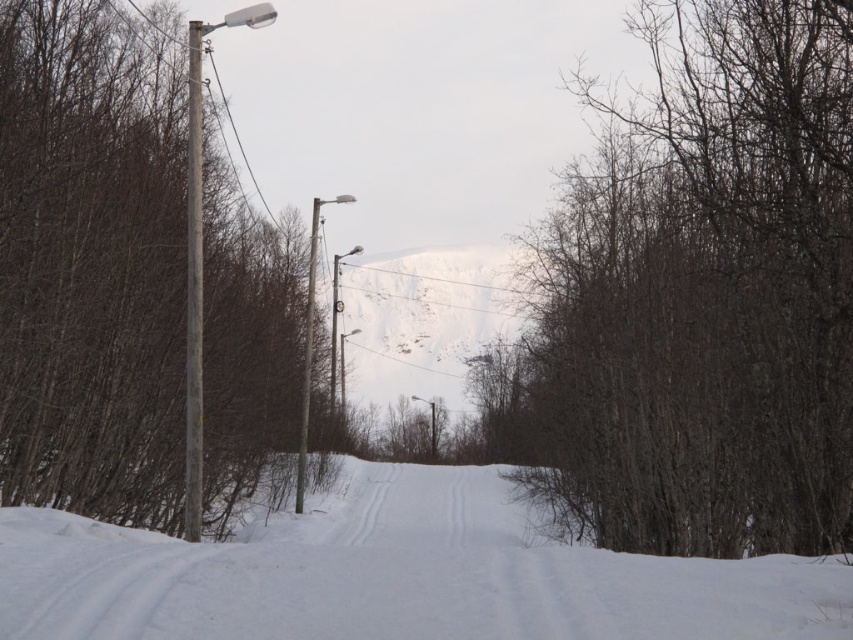
Is smooth brown pole at left to the right of white powdery snow at center from the viewer's perspective?

In fact, smooth brown pole at left is to the left of white powdery snow at center.

Find the location of a particular element. smooth brown pole at left is located at coordinates [x=134, y=275].

Is point (125, 467) more distant than point (793, 605)?

Yes, it is behind point (793, 605).

Identify the location of smooth brown pole at left. The width and height of the screenshot is (853, 640). (134, 275).

Between smooth brown pole at left and smooth gray pole at left, which one appears on the right side from the viewer's perspective?

Positioned to the right is smooth gray pole at left.

Which is more to the left, smooth brown pole at left or smooth gray pole at left?

A: smooth brown pole at left is more to the left.

Locate an element on the screen. This screenshot has height=640, width=853. smooth brown pole at left is located at coordinates (134, 275).

Locate an element on the screen. The height and width of the screenshot is (640, 853). smooth brown pole at left is located at coordinates (134, 275).

Between brown/dry wood at center and white powdery snow at center, which one is positioned higher?

Positioned higher is brown/dry wood at center.

Can you confirm if brown/dry wood at center is shorter than white powdery snow at center?

No.

Is point (843, 531) positioned behind point (126, 595)?

Yes, point (843, 531) is farther from viewer.

At what (x,y) coordinates should I click in order to perform the action: click on brown/dry wood at center. Please return your answer as a coordinate pair (x, y). This screenshot has height=640, width=853. Looking at the image, I should click on (701, 298).